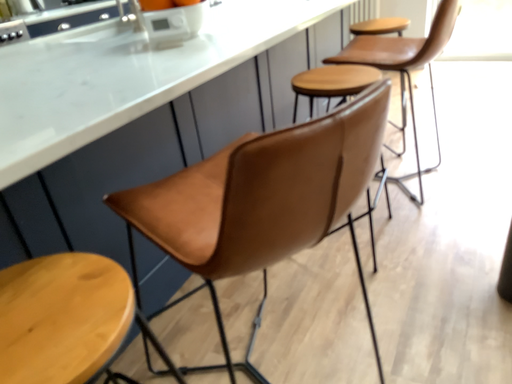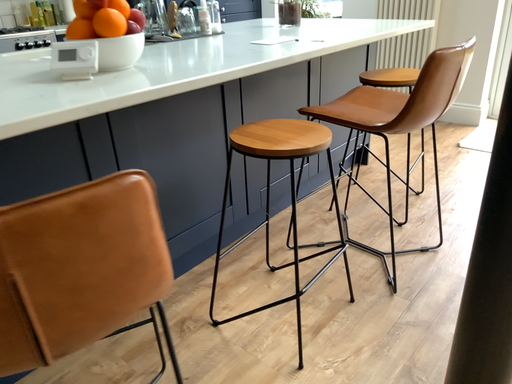
Question: How did the camera likely rotate when shooting the video?

Choices:
 (A) rotated right
 (B) rotated left

Answer: (B)